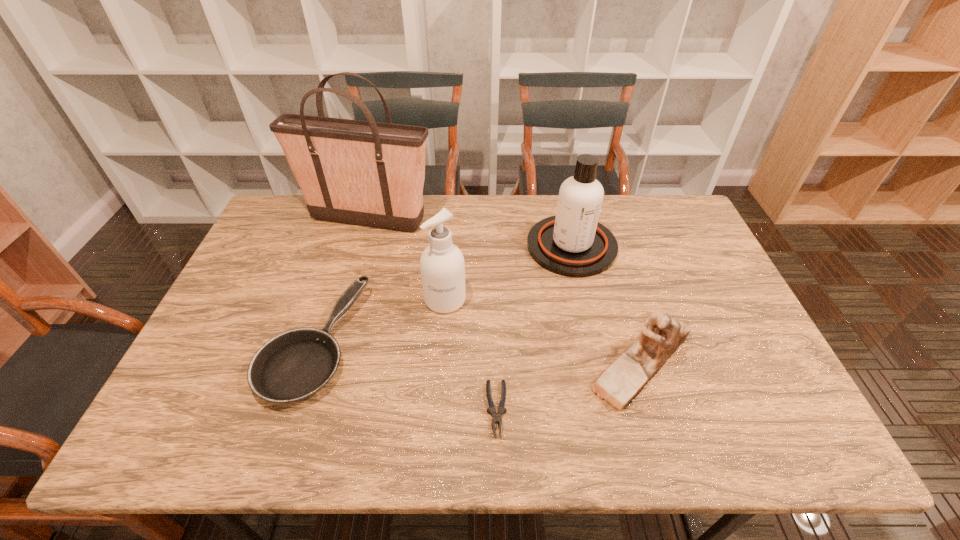
This screenshot has height=540, width=960. Identify the location of vacant space at the left edge of the desktop. (214, 361).

The image size is (960, 540). I want to click on blank area at the right edge, so click(735, 328).

Find the location of a particular element. This screenshot has height=540, width=960. free location at the near left corner of the desktop is located at coordinates [x=157, y=426].

In the image, there is a desktop. Identify the location of blank space at the far right corner. This screenshot has width=960, height=540. (667, 197).

Locate an element on the screen. vacant space in between the figurine and the farther cleansing agent is located at coordinates tap(607, 305).

The image size is (960, 540). What are the coordinates of `vacant space that is in between the figurine and the fourth object from left to right` in the screenshot? It's located at (569, 386).

The width and height of the screenshot is (960, 540). Identify the location of vacant point located between the shopping bag and the farther cleansing agent. (469, 233).

At what (x,y) coordinates should I click in order to perform the action: click on free space between the third object from right to left and the figurine. Please return your answer as a coordinate pair (x, y). This screenshot has width=960, height=540. Looking at the image, I should click on (569, 386).

At what (x,y) coordinates should I click in order to perform the action: click on vacant region between the right cleansing agent and the fourth tallest object. Please return your answer as a coordinate pair (x, y). Looking at the image, I should click on (607, 305).

This screenshot has height=540, width=960. In order to click on free space between the fifth tallest object and the nearer cleansing agent in this screenshot , I will do `click(379, 322)`.